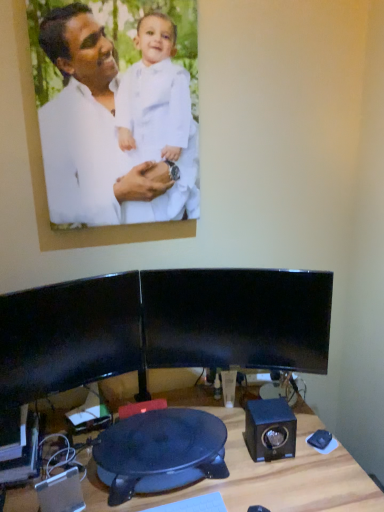
At what (x,y) coordinates should I click in order to perform the action: click on free space on the front side of blue matte speaker at lower right, which ranks as the second speaker in left-to-right order. Please return your answer as a coordinate pair (x, y). Looking at the image, I should click on (278, 484).